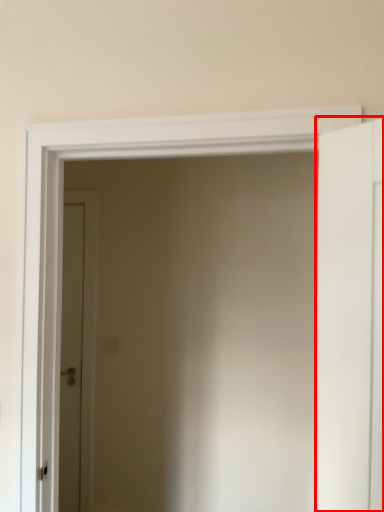
Question: From the image's perspective, considering the relative positions of door (annotated by the red box) and door in the image provided, where is door (annotated by the red box) located with respect to the staircase?

Choices:
 (A) above
 (B) below

Answer: (A)